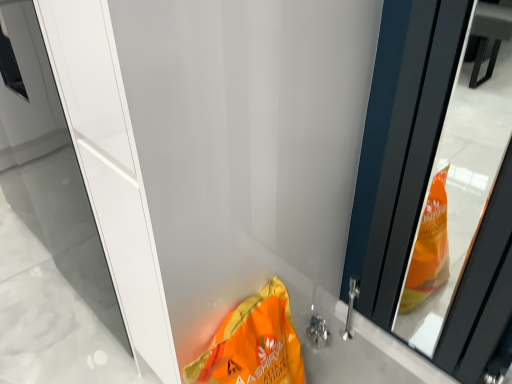
Identify the location of orange matte bag at lower center. (253, 344).

What do you see at coordinates (253, 344) in the screenshot? I see `orange matte bag at lower center` at bounding box center [253, 344].

This screenshot has width=512, height=384. What do you see at coordinates (110, 168) in the screenshot?
I see `white glossy screen door at center` at bounding box center [110, 168].

What are the coordinates of `white glossy screen door at center` in the screenshot? It's located at (110, 168).

In order to face white glossy screen door at center, should I rotate leftwards or rightwards?

A 21.513 degree turn to the left will do.

I want to click on orange matte bag at lower center, so click(x=253, y=344).

Which object is positioned more to the right, orange matte bag at lower center or white glossy screen door at center?

Positioned to the right is orange matte bag at lower center.

In the image, is orange matte bag at lower center positioned in front of or behind white glossy screen door at center?

Clearly, orange matte bag at lower center is behind white glossy screen door at center.

Does point (273, 295) come in front of point (133, 268)?

No, (273, 295) is further to viewer.

From the image's perspective, is orange matte bag at lower center under white glossy screen door at center?

Yes, from the image's perspective, orange matte bag at lower center is beneath white glossy screen door at center.

From a real-world perspective, who is located higher, orange matte bag at lower center or white glossy screen door at center?

white glossy screen door at center, from a real-world perspective.

Looking at their sizes, would you say orange matte bag at lower center is wider or thinner than white glossy screen door at center?

Considering their sizes, orange matte bag at lower center looks slimmer than white glossy screen door at center.

Who is shorter, orange matte bag at lower center or white glossy screen door at center?

orange matte bag at lower center is shorter.

Considering the sizes of objects orange matte bag at lower center and white glossy screen door at center in the image provided, who is bigger, orange matte bag at lower center or white glossy screen door at center?

Bigger between the two is white glossy screen door at center.

Can white glossy screen door at center be found inside orange matte bag at lower center?

No, white glossy screen door at center is not inside orange matte bag at lower center.

Is orange matte bag at lower center far away from white glossy screen door at center?

They are positioned close to each other.

Could you tell me if orange matte bag at lower center is turned towards white glossy screen door at center?

No, orange matte bag at lower center is not facing towards white glossy screen door at center.

Locate an element on the screen. Image resolution: width=512 pixels, height=384 pixels. screen door lying above the orange matte bag at lower center (from the image's perspective) is located at coordinates (110, 168).

Between white glossy screen door at center and orange matte bag at lower center, which one appears on the left side from the viewer's perspective?

From the viewer's perspective, white glossy screen door at center appears more on the left side.

Is white glossy screen door at center in front of or behind orange matte bag at lower center in the image?

In the image, white glossy screen door at center appears in front of orange matte bag at lower center.

Between point (93, 114) and point (206, 353), which one is positioned behind?

The point (206, 353) is more distant.

From the image's perspective, is white glossy screen door at center above or below orange matte bag at lower center?

Clearly, from the image's perspective, white glossy screen door at center is above orange matte bag at lower center.

From a real-world perspective, who is located higher, white glossy screen door at center or orange matte bag at lower center?

In real-world perspective, white glossy screen door at center is above.

Does white glossy screen door at center have a lesser width compared to orange matte bag at lower center?

Incorrect, the width of white glossy screen door at center is not less than that of orange matte bag at lower center.

Between white glossy screen door at center and orange matte bag at lower center, which one has less height?

Standing shorter between the two is orange matte bag at lower center.

In the scene shown: Who is bigger, white glossy screen door at center or orange matte bag at lower center?

white glossy screen door at center is bigger.

Is white glossy screen door at center inside the boundaries of orange matte bag at lower center, or outside?

white glossy screen door at center is not inside orange matte bag at lower center, it's outside.

Is white glossy screen door at center touching orange matte bag at lower center?

No, white glossy screen door at center is not making contact with orange matte bag at lower center.

Is white glossy screen door at center oriented away from orange matte bag at lower center?

No, white glossy screen door at center's orientation is not away from orange matte bag at lower center.

How different are the orientations of white glossy screen door at center and orange matte bag at lower center in degrees?

white glossy screen door at center and orange matte bag at lower center are facing 0.707 degrees away from each other.

How distant is white glossy screen door at center from orange matte bag at lower center?

white glossy screen door at center is 11.83 inches from orange matte bag at lower center.

Locate an element on the screen. screen door above the orange matte bag at lower center (from a real-world perspective) is located at coordinates (110, 168).

Identify the location of screen door lying above the orange matte bag at lower center (from the image's perspective). The height and width of the screenshot is (384, 512). (110, 168).

Image resolution: width=512 pixels, height=384 pixels. Find the location of `waste behind the white glossy screen door at center`. waste behind the white glossy screen door at center is located at coordinates (253, 344).